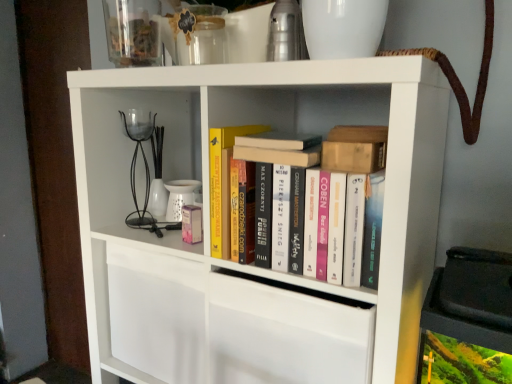
Question: Considering the relative sizes of hardcover book at center, arranged as the fourth book when ordered from the bottom, and wooden block at upper right, the 2th book when ordered from bottom to top, in the image provided, is hardcover book at center, arranged as the fourth book when ordered from the bottom, smaller than wooden block at upper right, the 2th book when ordered from bottom to top,?

Choices:
 (A) yes
 (B) no

Answer: (B)

Question: Does hardcover book at center, arranged as the fourth book when ordered from the bottom, have a lesser width compared to wooden block at upper right, which is the third book from top to bottom?

Choices:
 (A) no
 (B) yes

Answer: (A)

Question: Would you consider hardcover book at center, arranged as the fourth book when ordered from the bottom, to be distant from wooden block at upper right, which is the third book from top to bottom?

Choices:
 (A) yes
 (B) no

Answer: (B)

Question: From the image's perspective, does hardcover book at center, arranged as the fourth book when ordered from the bottom, appear higher than wooden block at upper right, the 2th book when ordered from bottom to top?

Choices:
 (A) yes
 (B) no

Answer: (A)

Question: From a real-world perspective, does hardcover book at center, arranged as the fourth book when ordered from the bottom, stand above wooden block at upper right, which is the third book from top to bottom?

Choices:
 (A) yes
 (B) no

Answer: (A)

Question: From the image's perspective, would you say hardcover book at center, arranged as the fourth book when ordered from the bottom, is shown under wooden block at upper right, which is the third book from top to bottom?

Choices:
 (A) no
 (B) yes

Answer: (A)

Question: Considering the relative sizes of transparent glass jar at upper center and yellow hardcover book at center in the image provided, is transparent glass jar at upper center thinner than yellow hardcover book at center?

Choices:
 (A) no
 (B) yes

Answer: (B)

Question: Does transparent glass jar at upper center have a smaller size compared to yellow hardcover book at center?

Choices:
 (A) yes
 (B) no

Answer: (A)

Question: From the image's perspective, is transparent glass jar at upper center located beneath yellow hardcover book at center?

Choices:
 (A) yes
 (B) no

Answer: (B)

Question: Is transparent glass jar at upper center to the left of yellow hardcover book at center from the viewer's perspective?

Choices:
 (A) no
 (B) yes

Answer: (B)

Question: Is transparent glass jar at upper center at the right side of yellow hardcover book at center?

Choices:
 (A) no
 (B) yes

Answer: (A)

Question: Is transparent glass jar at upper center facing away from yellow hardcover book at center?

Choices:
 (A) yes
 (B) no

Answer: (B)

Question: From the image's perspective, is hardcover books at center, the 4th book from the top, on hardcover book at center, the 2th book positioned from the top?

Choices:
 (A) no
 (B) yes

Answer: (A)